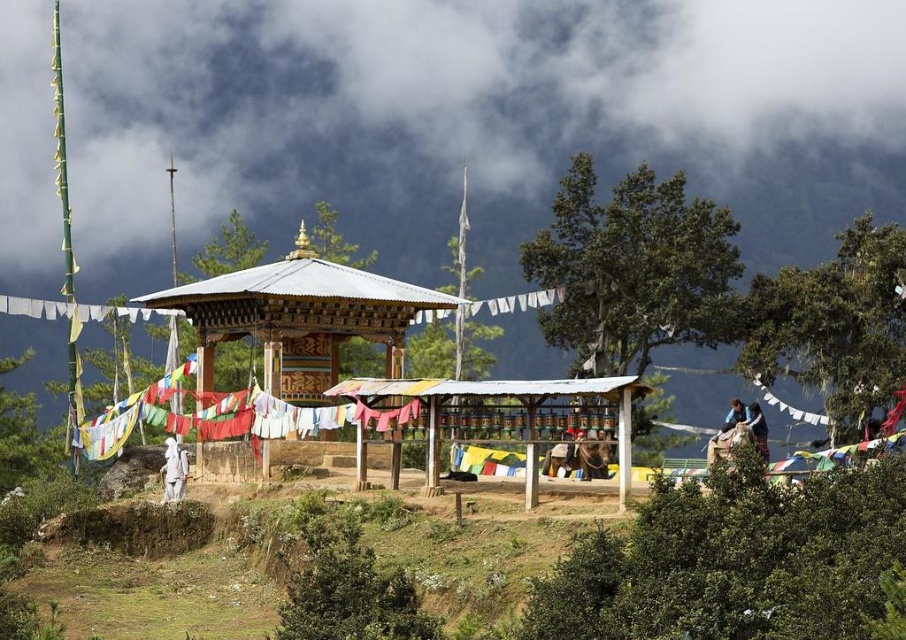
You are an observer looking at the scene. There is a dark gray cloud at upper center and a green leafy tree at upper center. Which object is located higher in the image?

The dark gray cloud at upper center is positioned over the green leafy tree at upper center, so it is higher in the image.

You are an artist planning to paint the scene. You want to ensure the green leafy tree at upper center and the green leafy tree at upper right are proportionally accurate. Which tree should you draw wider in your painting?

The green leafy tree at upper center should be drawn wider than the green leafy tree at upper right.